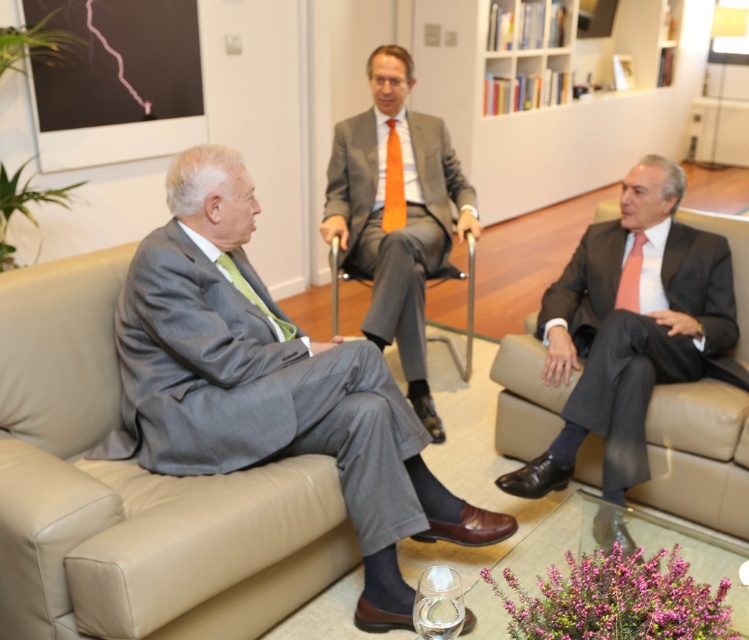
Question: Can you confirm if orange silk tie at center is wider than green silk tie at left?

Choices:
 (A) no
 (B) yes

Answer: (A)

Question: Which point is farther to the camera?

Choices:
 (A) matte black suit at right
 (B) beige leather couch at left

Answer: (A)

Question: Can you confirm if beige leather couch at left is positioned to the right of matte gray suit at center?

Choices:
 (A) no
 (B) yes

Answer: (A)

Question: Which point is farther to the camera?

Choices:
 (A) metallic gray chair at center
 (B) green silk tie at left
 (C) matte black suit at right
 (D) orange silk tie at center

Answer: (D)

Question: Is beige leather couch at left further to camera compared to metallic gray chair at center?

Choices:
 (A) yes
 (B) no

Answer: (B)

Question: Which object appears farthest from the camera in this image?

Choices:
 (A) gray fabric suit at left
 (B) beige leather couch at left
 (C) matte orange tie at right
 (D) matte gray suit at center

Answer: (D)